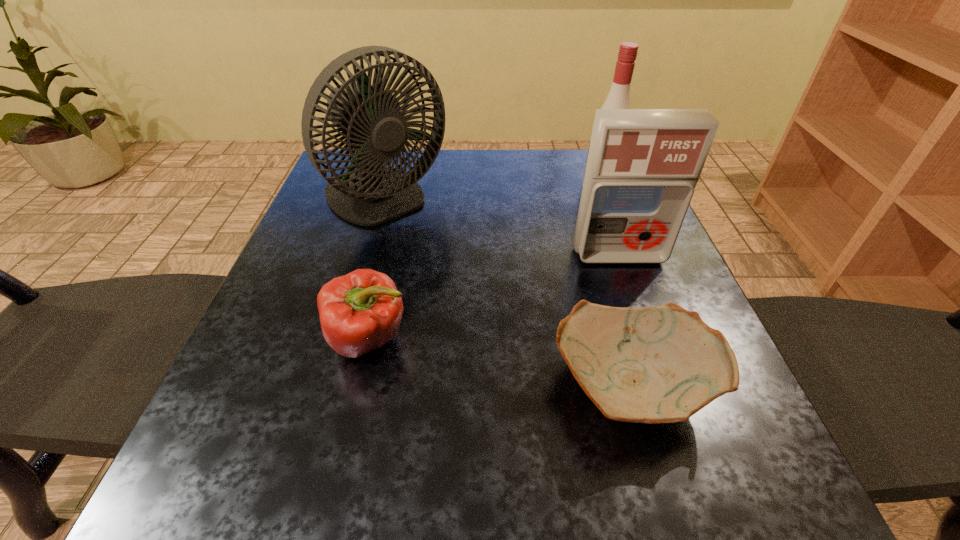
I want to click on vacant area situated on the back of the bell pepper, so click(x=396, y=227).

I want to click on free location located on the left of the shortest object, so [x=391, y=386].

Locate an element on the screen. The image size is (960, 540). fan situated at the far edge is located at coordinates (370, 117).

Image resolution: width=960 pixels, height=540 pixels. Identify the location of alcohol located at the far edge. (618, 97).

Find the location of a particular element. The width and height of the screenshot is (960, 540). fan positioned at the left edge is located at coordinates (370, 117).

What are the coordinates of `bell pepper positioned at the left edge` in the screenshot? It's located at (361, 311).

Locate an element on the screen. alcohol present at the right edge is located at coordinates (618, 97).

Identify the location of the first-aid kit that is at the right edge. (643, 165).

Image resolution: width=960 pixels, height=540 pixels. I want to click on pottery that is at the right edge, so click(x=659, y=364).

Identify the location of object that is positioned at the far left corner. The width and height of the screenshot is (960, 540). (370, 117).